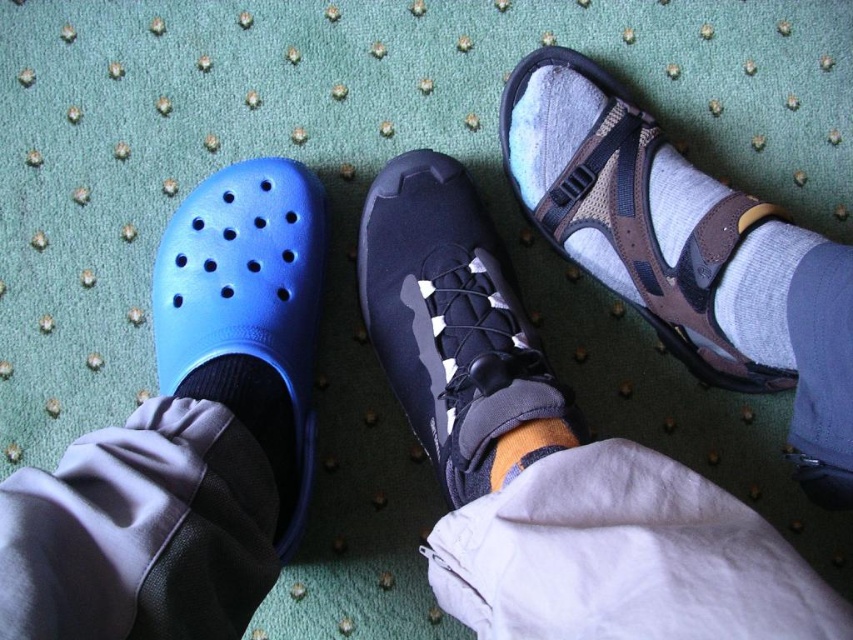
Between black knit sock at lower left and orange woolen sock at center, which one is positioned higher?

Positioned higher is orange woolen sock at center.

Which is behind, point (215, 397) or point (505, 465)?

The point (215, 397) is behind.

Where is `black knit sock at lower left`? The height and width of the screenshot is (640, 853). black knit sock at lower left is located at coordinates (254, 420).

Between brown mesh sandal at upper right and blue rubber clog at left, which one is positioned lower?

blue rubber clog at left is below.

Between brown mesh sandal at upper right and blue rubber clog at left, which one is positioned higher?

brown mesh sandal at upper right is higher up.

Locate an element on the screen. The height and width of the screenshot is (640, 853). brown mesh sandal at upper right is located at coordinates (642, 225).

Image resolution: width=853 pixels, height=640 pixels. Find the location of `brown mesh sandal at upper right`. brown mesh sandal at upper right is located at coordinates (642, 225).

Can you confirm if navy suede sneaker at center is smaller than black knit sock at lower left?

No, navy suede sneaker at center is not smaller than black knit sock at lower left.

Can you confirm if navy suede sneaker at center is positioned to the left of black knit sock at lower left?

No, navy suede sneaker at center is not to the left of black knit sock at lower left.

Locate an element on the screen. Image resolution: width=853 pixels, height=640 pixels. navy suede sneaker at center is located at coordinates (456, 328).

At what (x,y) coordinates should I click in order to perform the action: click on navy suede sneaker at center. Please return your answer as a coordinate pair (x, y). Looking at the image, I should click on pyautogui.click(x=456, y=328).